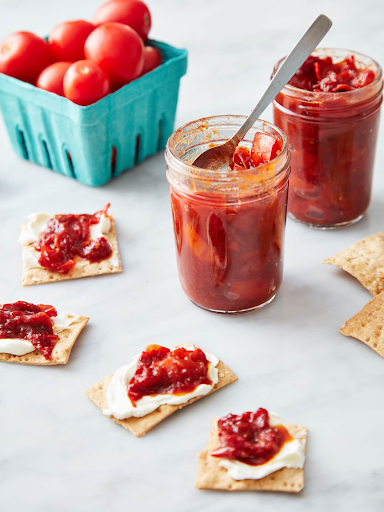
Identify the location of white tablecloth. The image size is (384, 512). (149, 211), (55, 467), (325, 385).